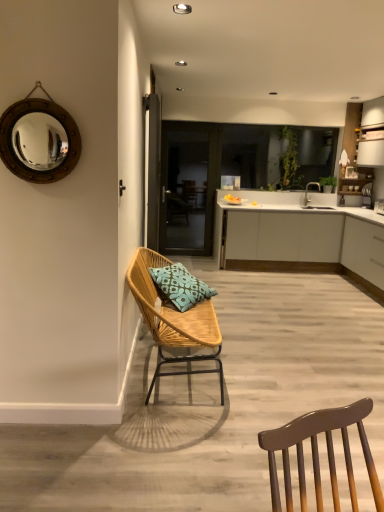
Question: From a real-world perspective, relative to transparent glass door at center, is woven wood chair with blue patterned cushion at left vertically above or below?

Choices:
 (A) above
 (B) below

Answer: (B)

Question: Visually, is woven wood chair with blue patterned cushion at left positioned to the left or to the right of transparent glass door at center?

Choices:
 (A) left
 (B) right

Answer: (A)

Question: Considering the real-world distances, which object is farthest from the white matte cabinet at center, the 2th cabinetry in the front-to-back sequence?

Choices:
 (A) woven wood chair with blue patterned cushion at left
 (B) transparent glass door at center
 (C) white matte cabinet at right, placed as the 2th cabinetry when sorted from back to front
 (D) wooden frame mirror at upper left
 (E) teal fabric pillow at center

Answer: (D)

Question: Which object is positioned farthest from the teal fabric pillow at center?

Choices:
 (A) wooden frame mirror at upper left
 (B) transparent glass door at center
 (C) white matte cabinet at center, the 2th cabinetry in the front-to-back sequence
 (D) white matte cabinet at right, which is counted as the first cabinetry, starting from the front
 (E) woven wood chair with blue patterned cushion at left

Answer: (B)